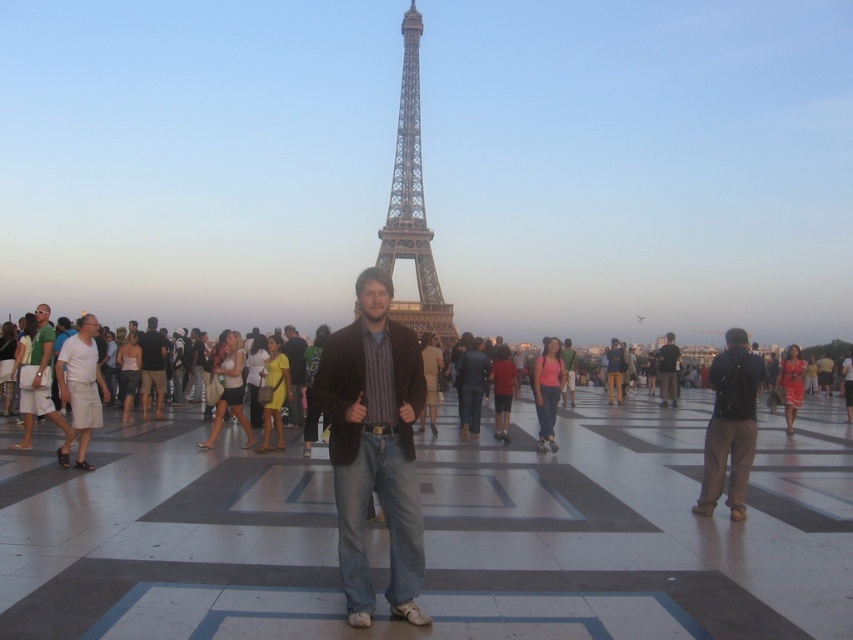
You are a photographer trying to capture the metallic gold eiffel tower at center and the dark blue jeans at center in a single shot. Which object will appear larger in your photo?

The metallic gold eiffel tower at center will appear larger in the photo because it is closer to the viewer than the dark blue jeans at center.

You are a photographer trying to capture the metallic gold eiffel tower at center and the green cotton shirt at left in the same frame. Which object will appear narrower in your photo?

The metallic gold eiffel tower at center will appear narrower in the photo because it is thinner than the green cotton shirt at left.

You are a photographer trying to capture both the green cotton shirt at left and the striped fabric shirt at center in a single shot. Which shirt should you focus on first to ensure both are in frame?

The green cotton shirt at left is taller than the striped fabric shirt at center, so focusing on the taller green cotton shirt at left first will help ensure both shirts are captured in the frame.